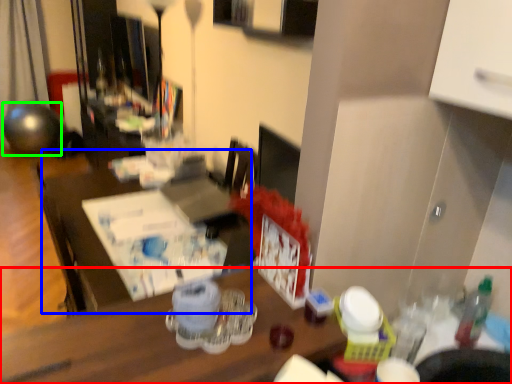
Question: Based on their relative distances, which object is nearer to desk (highlighted by a red box)? Choose from table (highlighted by a blue box) and ball (highlighted by a green box).

Choices:
 (A) table
 (B) ball

Answer: (A)